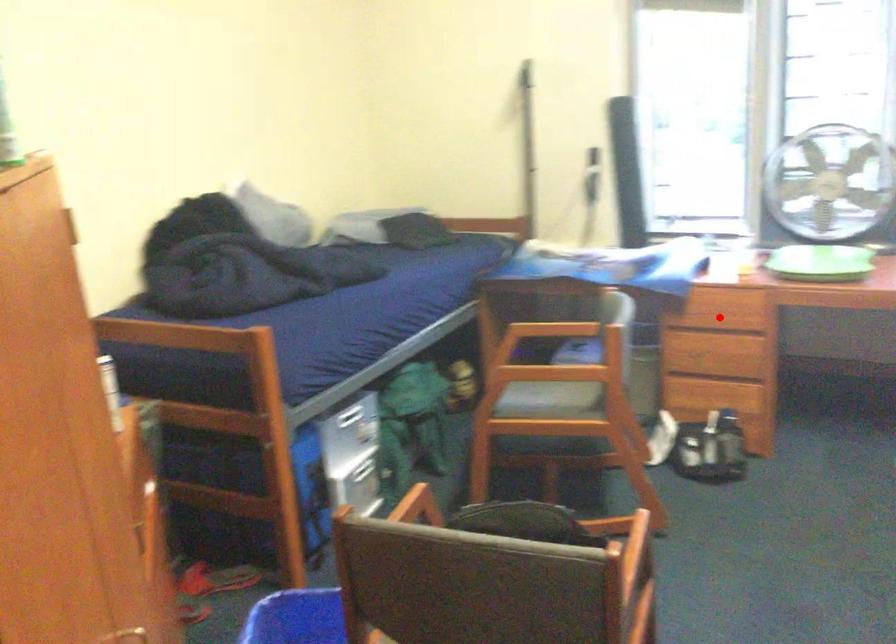
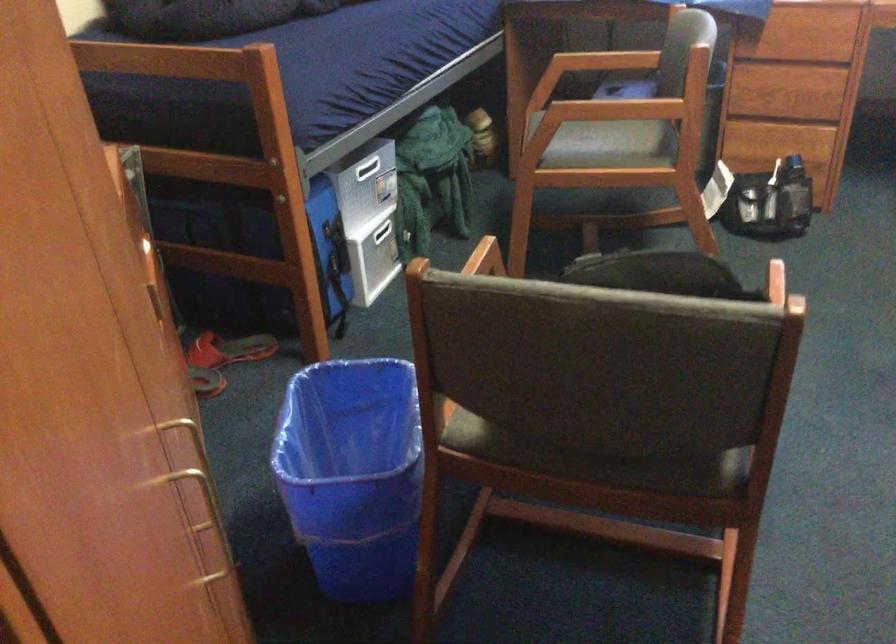
Question: I am providing you with two images of the same scene from different viewpoints. Given a red point in image1, look at the same physical point in image2. Is it:

Choices:
 (A) Closer to the viewpoint
 (B) Farther from the viewpoint

Answer: (A)